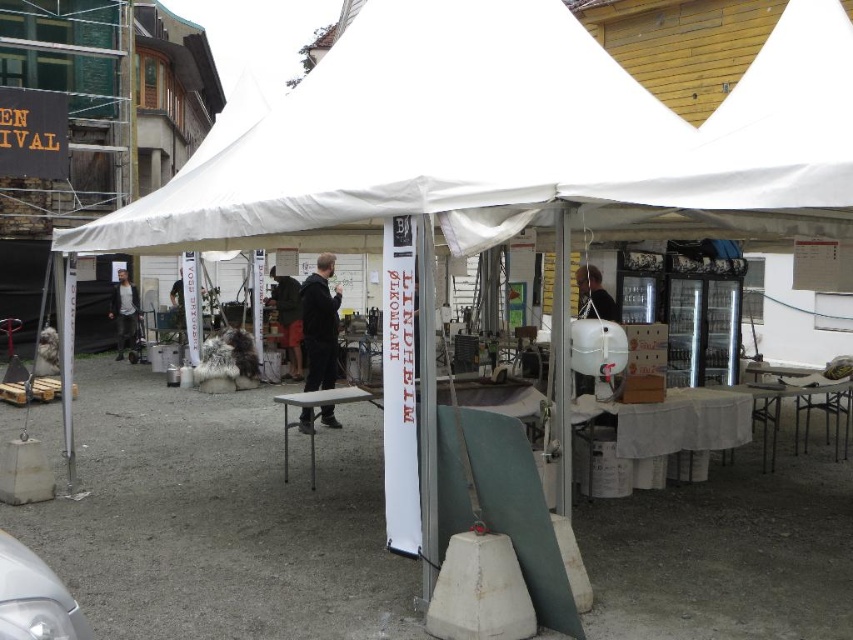
Question: Does black fabric jacket at center appear on the left side of dark brown leather jacket at center?

Choices:
 (A) no
 (B) yes

Answer: (A)

Question: Is white fabric canopy at upper center further to the viewer compared to matte white balloon at center-right?

Choices:
 (A) no
 (B) yes

Answer: (A)

Question: Which object appears farthest from the camera in this image?

Choices:
 (A) dark brown leather jacket at center
 (B) white fabric canopy at upper center
 (C) matte white balloon at center-right

Answer: (A)

Question: Which object is farther from the camera taking this photo?

Choices:
 (A) black fabric jacket at center
 (B) white fabric canopy at upper center
 (C) dark gray jacket at center
 (D) matte white balloon at center-right

Answer: (C)

Question: Considering the relative positions of white fabric canopy at upper center and matte white balloon at center-right in the image provided, where is white fabric canopy at upper center located with respect to matte white balloon at center-right?

Choices:
 (A) below
 (B) above

Answer: (B)

Question: Which point is closer to the camera?

Choices:
 (A) black fabric jacket at center
 (B) dark gray jacket at center

Answer: (A)